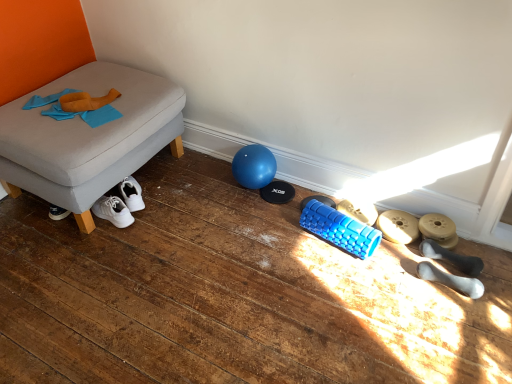
Locate an element on the screen. unoccupied area in front of white rubber dumbbell at lower right, which ranks as the first footwear in front-to-back order is located at coordinates (459, 323).